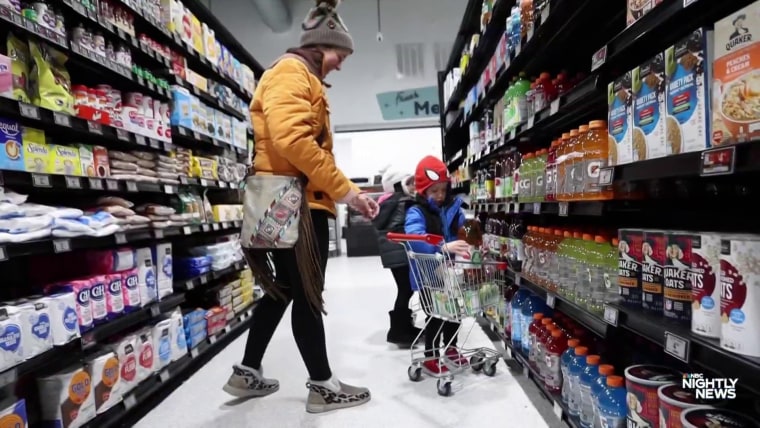
Locate an element on the screen. ceiling pipe is located at coordinates (277, 22).